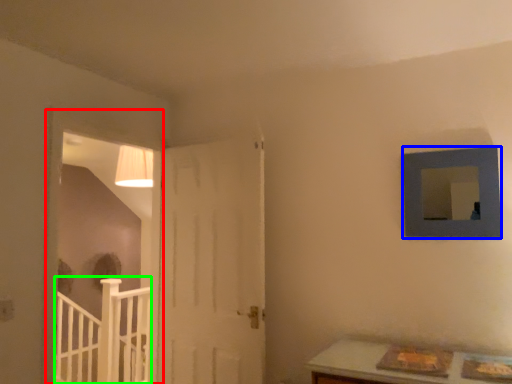
Question: Based on their relative distances, which object is farther from window frame (highlighted by a red box)? Choose from picture frame (highlighted by a blue box) and rail (highlighted by a green box).

Choices:
 (A) picture frame
 (B) rail

Answer: (A)